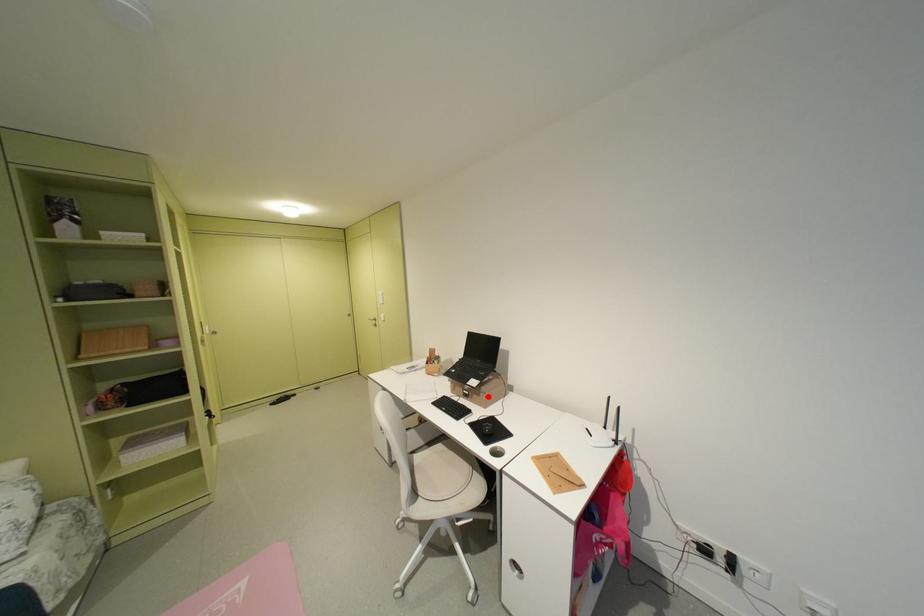
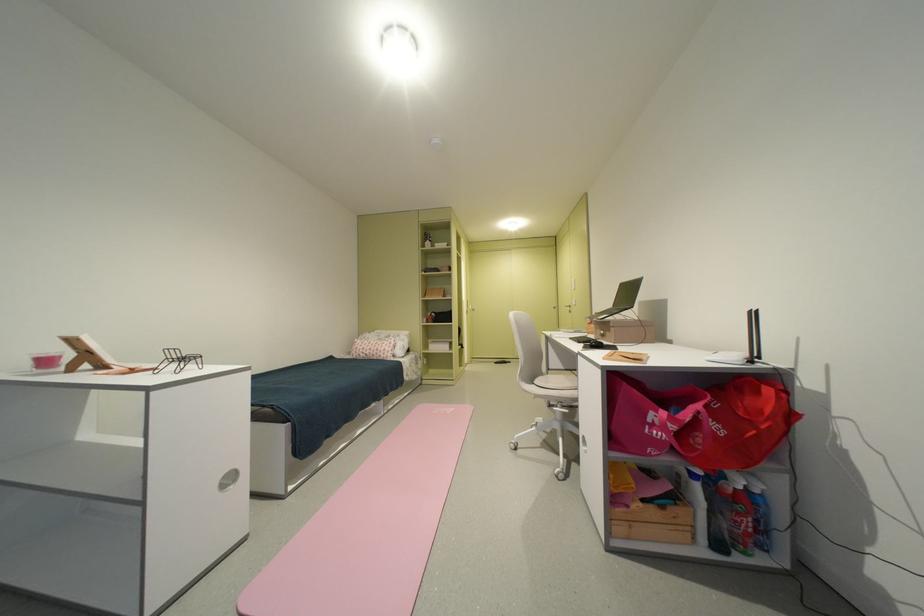
The point at the highlighted location is marked in the first image. Where is the corresponding point in the second image?

(618, 331)